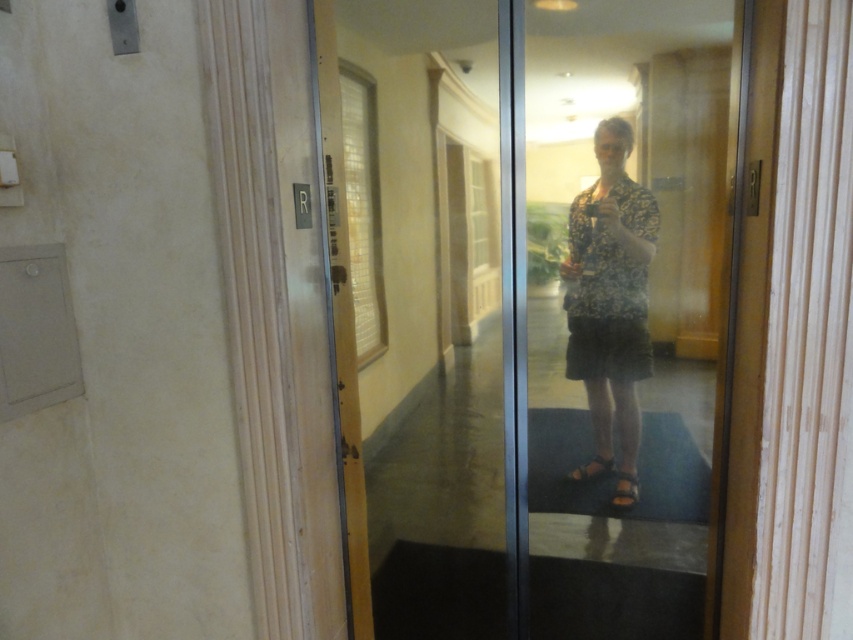
Question: Which point is closer to the camera?

Choices:
 (A) (595, 188)
 (B) (486, 305)

Answer: (A)

Question: Does transparent glass door at center appear on the right side of floral-patterned shirt at center?

Choices:
 (A) yes
 (B) no

Answer: (B)

Question: Can you confirm if transparent glass door at center is positioned to the right of floral-patterned shirt at center?

Choices:
 (A) yes
 (B) no

Answer: (B)

Question: Can you confirm if transparent glass door at center is wider than floral-patterned shirt at center?

Choices:
 (A) yes
 (B) no

Answer: (A)